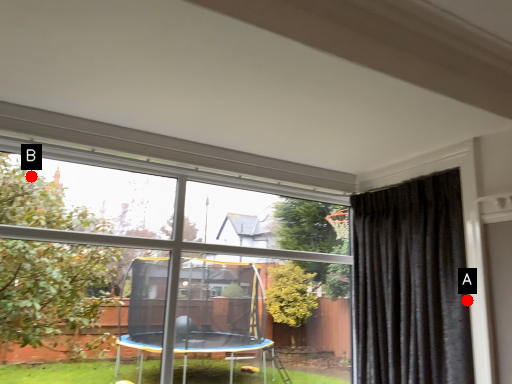
Question: Two points are circled on the image, labeled by A and B beside each circle. Which of the following is the farthest from the observer?

Choices:
 (A) A is further
 (B) B is further

Answer: (B)